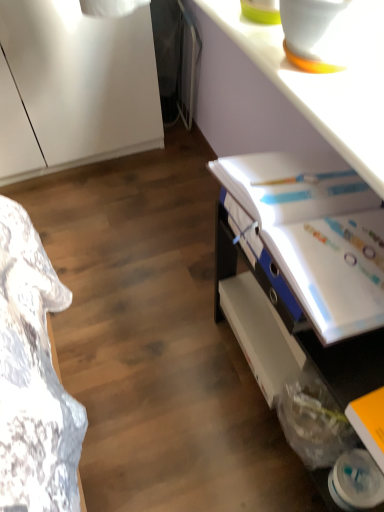
Question: Is yellow matte book at lower right, placed as the second book when sorted from top to bottom, next to white glossy counter top at upper right?

Choices:
 (A) yes
 (B) no

Answer: (B)

Question: From a real-world perspective, is yellow matte book at lower right, the first book from the bottom, below white glossy counter top at upper right?

Choices:
 (A) yes
 (B) no

Answer: (A)

Question: Can you confirm if yellow matte book at lower right, placed as the second book when sorted from back to front, is positioned to the right of white glossy counter top at upper right?

Choices:
 (A) no
 (B) yes

Answer: (B)

Question: Is yellow matte book at lower right, which appears as the 1th book when viewed from the front, aimed at white glossy counter top at upper right?

Choices:
 (A) yes
 (B) no

Answer: (B)

Question: Is yellow matte book at lower right, placed as the second book when sorted from top to bottom, wider than white glossy counter top at upper right?

Choices:
 (A) yes
 (B) no

Answer: (B)

Question: Is yellow matte book at lower right, which appears as the 1th book when viewed from the front, to the left of white glossy counter top at upper right from the viewer's perspective?

Choices:
 (A) no
 (B) yes

Answer: (A)

Question: From the image's perspective, is white glossy counter top at upper right over yellow matte book at lower right, placed as the second book when sorted from top to bottom?

Choices:
 (A) yes
 (B) no

Answer: (A)

Question: Considering the relative sizes of white glossy counter top at upper right and yellow matte book at lower right, placed as the second book when sorted from back to front, in the image provided, is white glossy counter top at upper right shorter than yellow matte book at lower right, placed as the second book when sorted from back to front,?

Choices:
 (A) no
 (B) yes

Answer: (B)

Question: Is white glossy counter top at upper right taller than yellow matte book at lower right, which appears as the 1th book when viewed from the front?

Choices:
 (A) no
 (B) yes

Answer: (A)

Question: Is white glossy counter top at upper right smaller than yellow matte book at lower right, placed as the second book when sorted from back to front?

Choices:
 (A) no
 (B) yes

Answer: (A)

Question: From a real-world perspective, is white glossy counter top at upper right below yellow matte book at lower right, the first book from the bottom?

Choices:
 (A) no
 (B) yes

Answer: (A)

Question: From the image's perspective, does white glossy counter top at upper right appear lower than yellow matte book at lower right, placed as the second book when sorted from back to front?

Choices:
 (A) yes
 (B) no

Answer: (B)

Question: Does white glossy binder at upper right, the first book in the top-to-bottom sequence, touch white glossy desk at lower right?

Choices:
 (A) yes
 (B) no

Answer: (A)